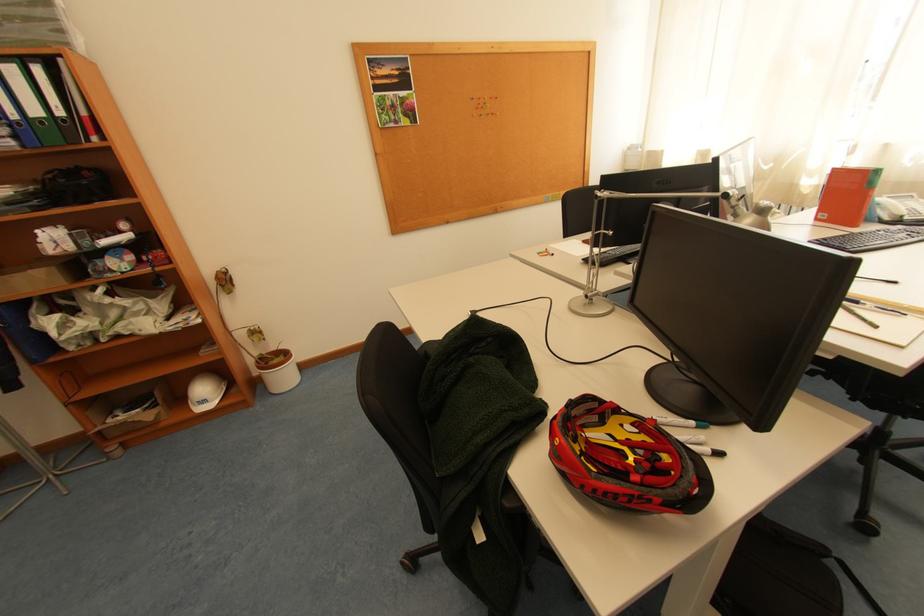
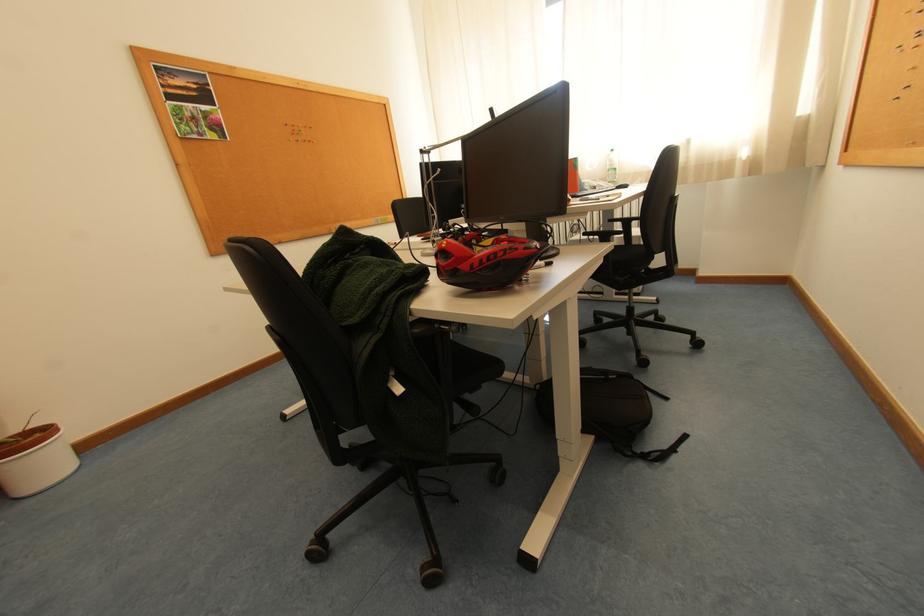
Question: The camera is either moving clockwise (left) or counter-clockwise (right) around the object. The first image is from the beginning of the video and the second image is from the end. Is the camera moving left or right when shooting the video?

Choices:
 (A) Left
 (B) Right

Answer: (A)